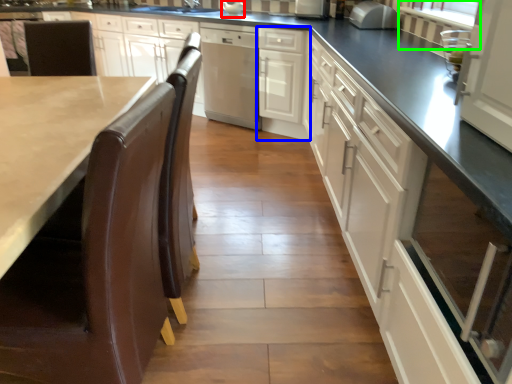
Question: Which object is positioned farthest from appliance (highlighted by a red box)? Select from cabinetry (highlighted by a blue box) and window screen (highlighted by a green box).

Choices:
 (A) cabinetry
 (B) window screen

Answer: (B)